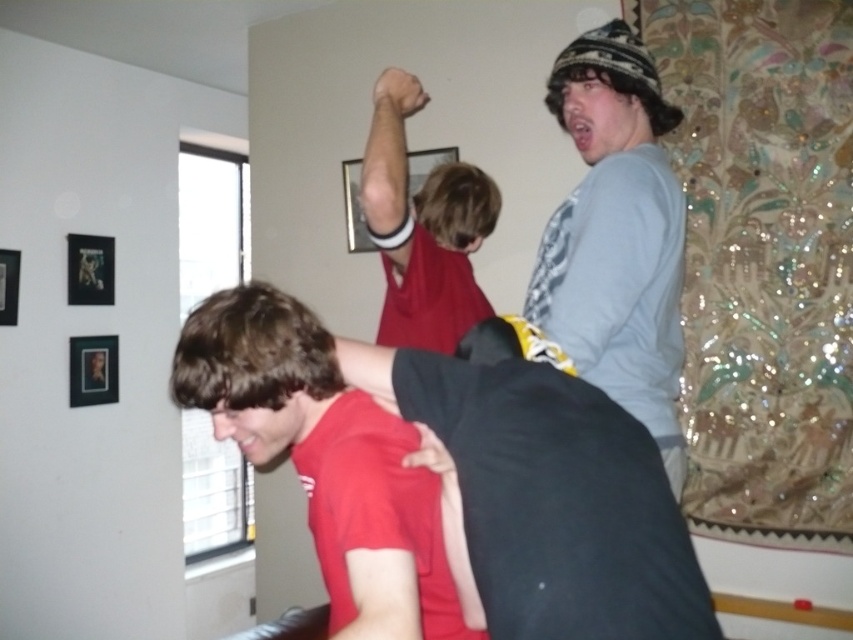
You are standing in the room and want to move from the point at coordinates point (107, 291) to the point at coordinates point (351, 241). Which direction should you move in order to reach your destination?

To move from point (107, 291) to point (351, 241), you should move upwards and to the left since point (107, 291) is behind point (351, 241).

You are standing at the point labeled point (105, 260) in the image. If you want to throw a ball to someone standing 3 meters away from you, can you reach them?

The distance between point (105, 260) and the viewer is 3.30 meters, so yes, you can reach someone 3 meters away by throwing the ball to them.

Consider the image. You are standing in the room and want to move from the point at coordinates point (115, 337) to the point at coordinates point (363, 234). Is the destination point in front of or behind you?

The point at coordinates point (363, 234) is in front of you because the point at coordinates point (115, 337) is behind it.